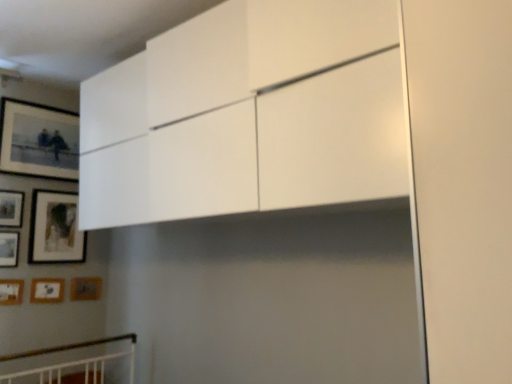
Question: Does point (37, 165) appear closer or farther from the camera than point (3, 264)?

Choices:
 (A) closer
 (B) farther

Answer: (B)

Question: Would you say matte black picture frame at upper left, positioned as the 7th picture frame in bottom-to-top order, is to the left or to the right of wooden matte picture frame at lower left, which appears as the 4th picture frame when viewed from the top, in the picture?

Choices:
 (A) left
 (B) right

Answer: (B)

Question: Which object is the farthest from the wooden matte picture frame at lower left, which appears as the 4th picture frame when viewed from the top?

Choices:
 (A) wooden matte picture frame at lower left, which appears as the 2th picture frame when ordered from the bottom
 (B) wooden matte picture frame at lower left, placed as the 7th picture frame when sorted from top to bottom
 (C) matte black picture frame at upper left, acting as the 3th picture frame starting from the top
 (D) wooden matte picture frame at left, the sixth picture frame ordered from the bottom
 (E) matte black picture frame at upper left, positioned as the 1th picture frame in top-to-bottom order

Answer: (E)

Question: Which is farther from the matte black picture frame at upper left, positioned as the 1th picture frame in top-to-bottom order?

Choices:
 (A) wooden matte picture frame at lower left, which appears as the 2th picture frame when ordered from the bottom
 (B) wooden matte picture frame at lower left, marked as the 1th picture frame in a bottom-to-top arrangement
 (C) wooden matte picture frame at lower left, which appears as the 4th picture frame when ordered from the bottom
 (D) wooden picture frame at lower left, which ranks as the fifth picture frame in top-to-bottom order
 (E) matte black picture frame at upper left, acting as the 3th picture frame starting from the top

Answer: (B)